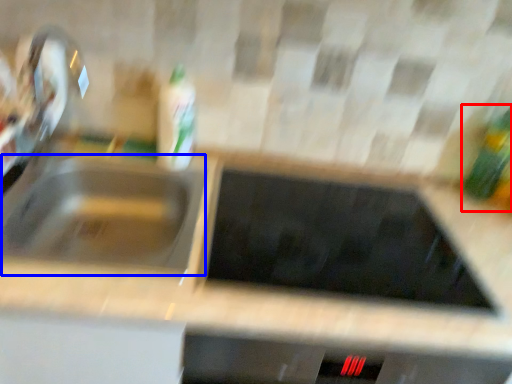
Question: Among these objects, which one is nearest to the camera, bottle (highlighted by a red box) or sink (highlighted by a blue box)?

Choices:
 (A) bottle
 (B) sink

Answer: (B)